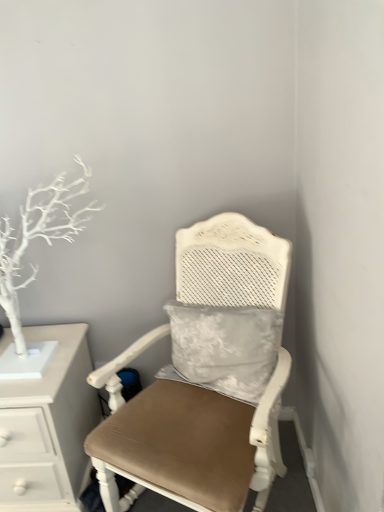
Where is `vacant location below white matte tree at left (from a real-world perspective)`? This screenshot has width=384, height=512. vacant location below white matte tree at left (from a real-world perspective) is located at coordinates (36, 367).